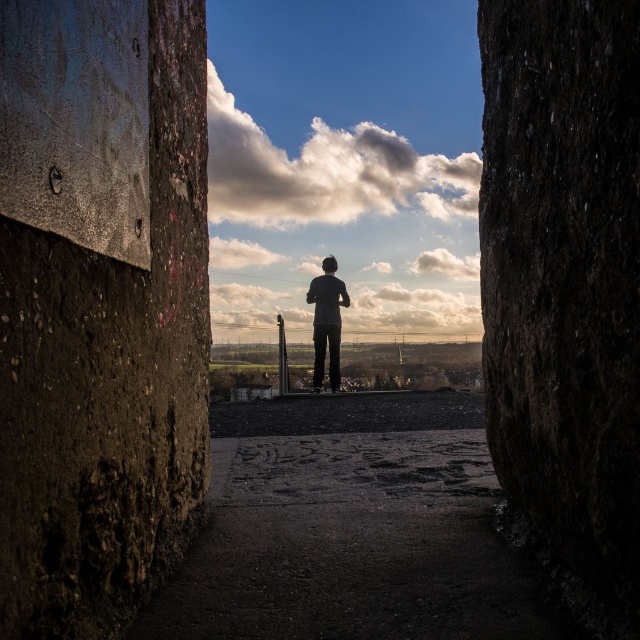
Find the location of a particular element. rusty concrete wall at center is located at coordinates (x=109, y=380).

Is rusty concrete wall at center closer to the viewer compared to smooth concrete pole at center?

Yes, it is in front of smooth concrete pole at center.

Does point (120, 486) lie in front of point (280, 332)?

Yes.

Where is `rusty concrete wall at center`? rusty concrete wall at center is located at coordinates (109, 380).

Can you confirm if rusty concrete wall at center is bigger than dark gray fabric at center?

Incorrect, rusty concrete wall at center is not larger than dark gray fabric at center.

The height and width of the screenshot is (640, 640). What do you see at coordinates (109, 380) in the screenshot?
I see `rusty concrete wall at center` at bounding box center [109, 380].

At what (x,y) coordinates should I click in order to perform the action: click on rusty concrete wall at center. Please return your answer as a coordinate pair (x, y). Looking at the image, I should click on (109, 380).

Is dark concrete alley at center thinner than dark gray fabric at center?

In fact, dark concrete alley at center might be wider than dark gray fabric at center.

The width and height of the screenshot is (640, 640). What do you see at coordinates (349, 528) in the screenshot? I see `dark concrete alley at center` at bounding box center [349, 528].

Who is more distant from viewer, (316, 522) or (336, 291)?

The point (336, 291) is more distant.

At what (x,y) coordinates should I click in order to perform the action: click on dark concrete alley at center. Please return your answer as a coordinate pair (x, y). This screenshot has height=640, width=640. Looking at the image, I should click on (349, 528).